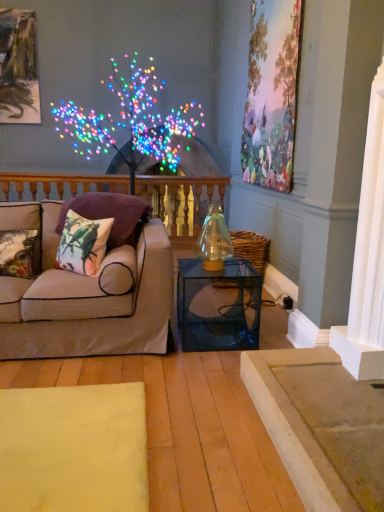
Question: Considering the relative positions of printed fabric pillow at left, positioned as the 2th pillow in left-to-right order, and metallic gold picture frame at upper left, the 1th picture frame when ordered from left to right, in the image provided, is printed fabric pillow at left, positioned as the 2th pillow in left-to-right order, behind metallic gold picture frame at upper left, the 1th picture frame when ordered from left to right,?

Choices:
 (A) yes
 (B) no

Answer: (B)

Question: Can you confirm if printed fabric pillow at left, the second pillow viewed from the right, is bigger than metallic gold picture frame at upper left, positioned as the 2th picture frame in front-to-back order?

Choices:
 (A) no
 (B) yes

Answer: (A)

Question: Is printed fabric pillow at left, the second pillow viewed from the right, oriented towards metallic gold picture frame at upper left, the 1th picture frame when ordered from left to right?

Choices:
 (A) no
 (B) yes

Answer: (A)

Question: Can you confirm if printed fabric pillow at left, positioned as the 2th pillow in left-to-right order, is wider than metallic gold picture frame at upper left, acting as the second picture frame starting from the right?

Choices:
 (A) no
 (B) yes

Answer: (B)

Question: Is printed fabric pillow at left, the second pillow viewed from the right, closer to camera compared to metallic gold picture frame at upper left, the 1th picture frame when ordered from left to right?

Choices:
 (A) yes
 (B) no

Answer: (A)

Question: From the image's perspective, is floral fabric cushion at left, marked as the 1th pillow in a left-to-right arrangement, located above or below fluffy purple pillow at left, marked as the third pillow in a left-to-right arrangement?

Choices:
 (A) below
 (B) above

Answer: (A)

Question: Relative to fluffy purple pillow at left, which is counted as the first pillow, starting from the right, is floral fabric cushion at left, which is the third pillow from right to left, in front or behind?

Choices:
 (A) front
 (B) behind

Answer: (A)

Question: Is floral fabric cushion at left, marked as the 1th pillow in a left-to-right arrangement, spatially inside fluffy purple pillow at left, which is counted as the first pillow, starting from the right, or outside of it?

Choices:
 (A) outside
 (B) inside

Answer: (A)

Question: Considering the positions of floral fabric cushion at left, which is the third pillow from right to left, and fluffy purple pillow at left, which is counted as the first pillow, starting from the right, in the image, is floral fabric cushion at left, which is the third pillow from right to left, wider or thinner than fluffy purple pillow at left, which is counted as the first pillow, starting from the right,?

Choices:
 (A) wide
 (B) thin

Answer: (B)

Question: Considering their positions, is metallic gold picture frame at upper left, positioned as the 2th picture frame in front-to-back order, located in front of or behind fluffy purple pillow at left, marked as the third pillow in a left-to-right arrangement?

Choices:
 (A) front
 (B) behind

Answer: (B)

Question: Is metallic gold picture frame at upper left, acting as the second picture frame starting from the right, to the left or to the right of fluffy purple pillow at left, which is counted as the first pillow, starting from the right, in the image?

Choices:
 (A) right
 (B) left

Answer: (B)

Question: Is point coord(23,93) closer or farther from the camera than point coord(129,234)?

Choices:
 (A) closer
 (B) farther

Answer: (B)

Question: Looking at their shapes, would you say metallic gold picture frame at upper left, acting as the second picture frame starting from the right, is wider or thinner than fluffy purple pillow at left, marked as the third pillow in a left-to-right arrangement?

Choices:
 (A) thin
 (B) wide

Answer: (A)

Question: In terms of height, does printed fabric pillow at left, the second pillow viewed from the right, look taller or shorter compared to transparent glass table at center?

Choices:
 (A) short
 (B) tall

Answer: (A)

Question: In terms of width, does printed fabric pillow at left, the second pillow viewed from the right, look wider or thinner when compared to transparent glass table at center?

Choices:
 (A) wide
 (B) thin

Answer: (B)